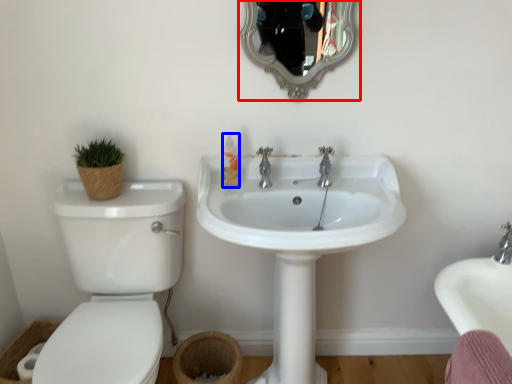
Question: Which object is further to the camera taking this photo, mirror (highlighted by a red box) or toiletry (highlighted by a blue box)?

Choices:
 (A) mirror
 (B) toiletry

Answer: (B)